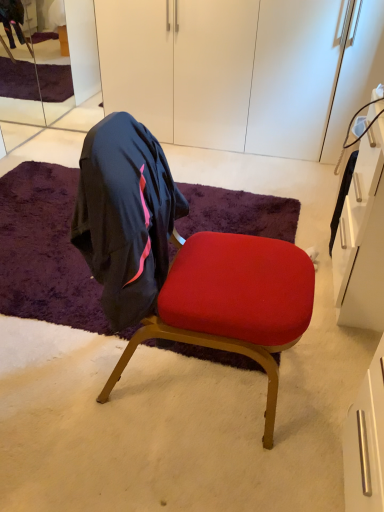
Question: From a real-world perspective, is clear glass mirror at upper left beneath velvet red chair at center?

Choices:
 (A) yes
 (B) no

Answer: (B)

Question: Is clear glass mirror at upper left positioned behind velvet red chair at center?

Choices:
 (A) no
 (B) yes

Answer: (B)

Question: Is clear glass mirror at upper left bigger than velvet red chair at center?

Choices:
 (A) yes
 (B) no

Answer: (B)

Question: From the image's perspective, is clear glass mirror at upper left on velvet red chair at center?

Choices:
 (A) yes
 (B) no

Answer: (A)

Question: Does clear glass mirror at upper left appear on the right side of velvet red chair at center?

Choices:
 (A) yes
 (B) no

Answer: (B)

Question: Considering the positions of purple shaggy rug at center and velvet red chair at center in the image, is purple shaggy rug at center taller or shorter than velvet red chair at center?

Choices:
 (A) tall
 (B) short

Answer: (B)

Question: In terms of width, does purple shaggy rug at center look wider or thinner when compared to velvet red chair at center?

Choices:
 (A) thin
 (B) wide

Answer: (B)

Question: Considering the positions of purple shaggy rug at center and velvet red chair at center in the image, is purple shaggy rug at center bigger or smaller than velvet red chair at center?

Choices:
 (A) small
 (B) big

Answer: (A)

Question: Is purple shaggy rug at center inside the boundaries of velvet red chair at center, or outside?

Choices:
 (A) inside
 (B) outside

Answer: (B)

Question: In terms of height, does purple shaggy rug at center look taller or shorter compared to white matte cabinet at upper center?

Choices:
 (A) tall
 (B) short

Answer: (B)

Question: Is point (61, 178) closer or farther from the camera than point (286, 4)?

Choices:
 (A) closer
 (B) farther

Answer: (B)

Question: Considering the positions of purple shaggy rug at center and white matte cabinet at upper center in the image, is purple shaggy rug at center wider or thinner than white matte cabinet at upper center?

Choices:
 (A) wide
 (B) thin

Answer: (A)

Question: Do you think purple shaggy rug at center is within white matte cabinet at upper center, or outside of it?

Choices:
 (A) outside
 (B) inside

Answer: (A)

Question: Considering the positions of velvet red chair at center and white matte cabinet at upper center in the image, is velvet red chair at center wider or thinner than white matte cabinet at upper center?

Choices:
 (A) wide
 (B) thin

Answer: (B)

Question: From a real-world perspective, is velvet red chair at center above or below white matte cabinet at upper center?

Choices:
 (A) above
 (B) below

Answer: (B)